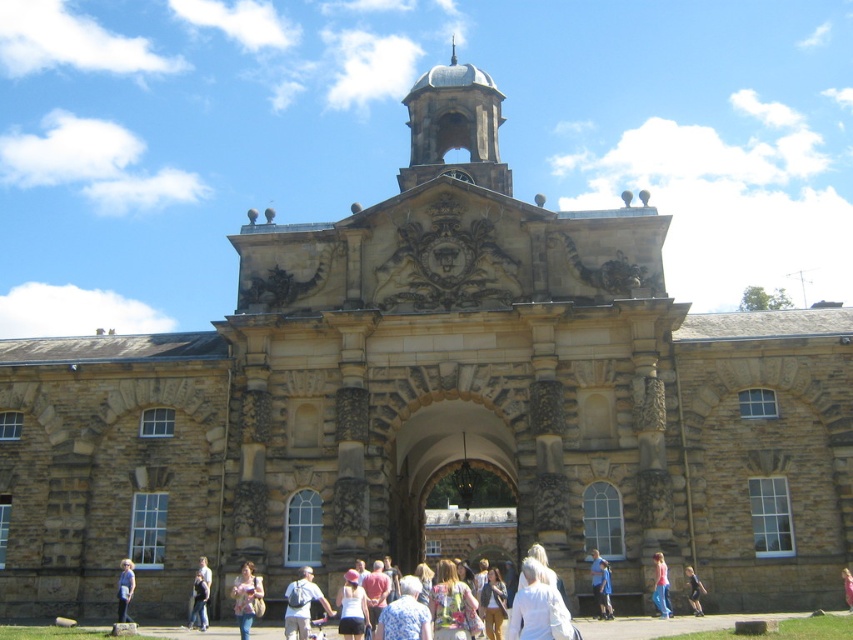
Question: Estimate the real-world distances between objects in this image. Which object is closer to the pink fabric at center?

Choices:
 (A) smooth stone bell tower at upper center
 (B) light brown fabric bag at lower center

Answer: (B)

Question: Where is white matte jacket at center located in relation to light brown fabric bag at lower center in the image?

Choices:
 (A) left
 (B) right

Answer: (B)

Question: Considering the relative positions of denim jeans at center and pink fabric at center in the image provided, where is denim jeans at center located with respect to pink fabric at center?

Choices:
 (A) above
 (B) below

Answer: (A)

Question: Which point appears closest to the camera in this image?

Choices:
 (A) (656, 600)
 (B) (306, 609)

Answer: (B)

Question: Among these objects, which one is farthest from the camera?

Choices:
 (A) blue denim jeans at lower center
 (B) pink fabric top at center
 (C) light gray backpack at center
 (D) light blue shirt at center

Answer: (A)

Question: Does pink fabric top at center appear under pink fabric at center?

Choices:
 (A) yes
 (B) no

Answer: (B)